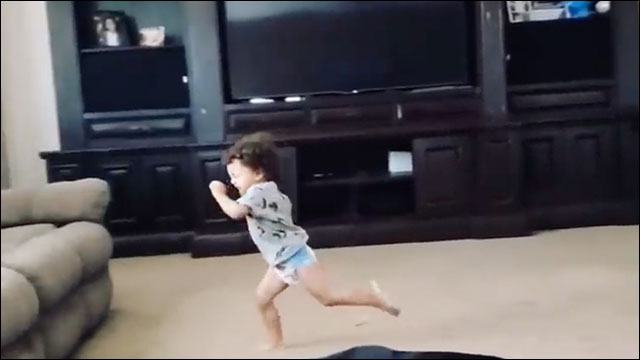
Find the location of a particular element. television is located at coordinates click(347, 30).